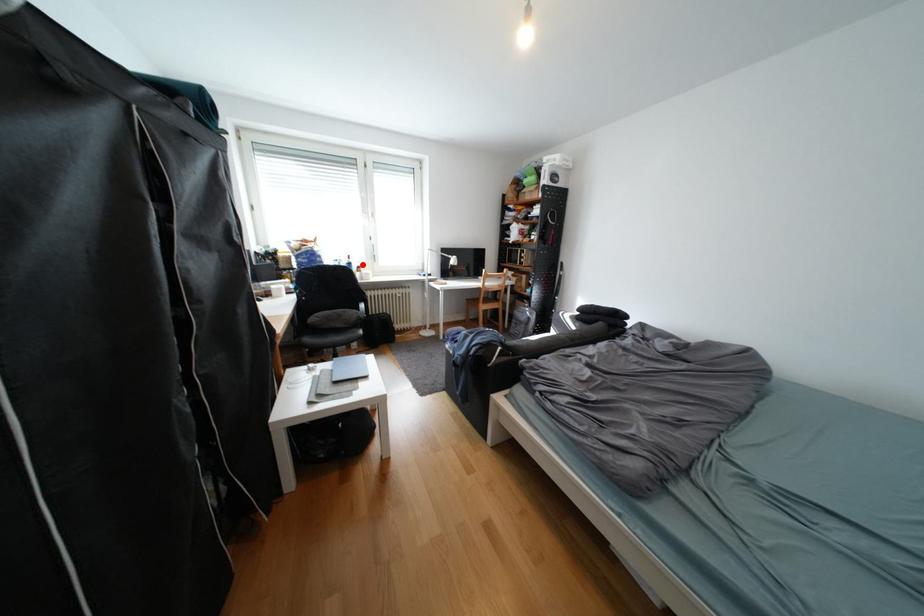
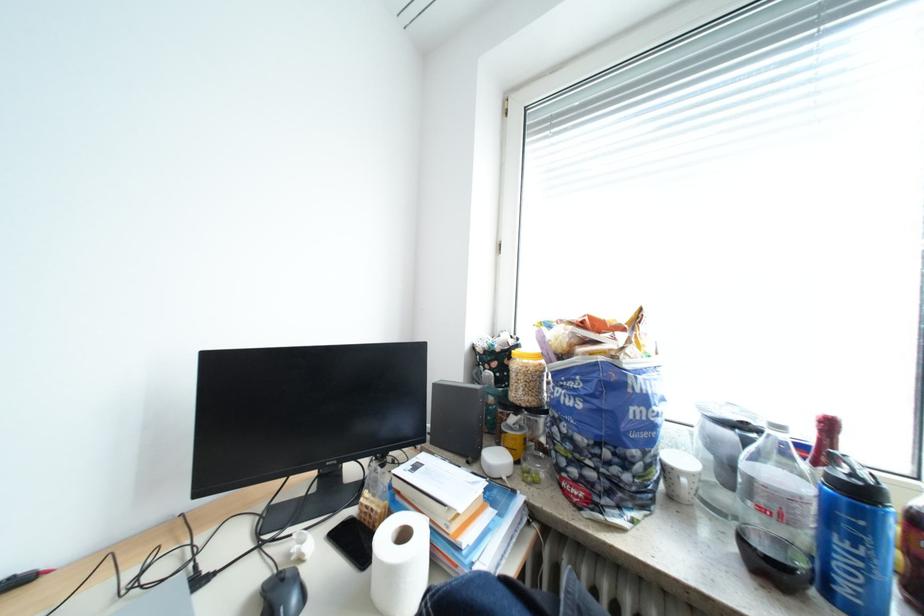
Locate, in the second image, the point that corresponds to the highlighted location in the first image.

(873, 493)